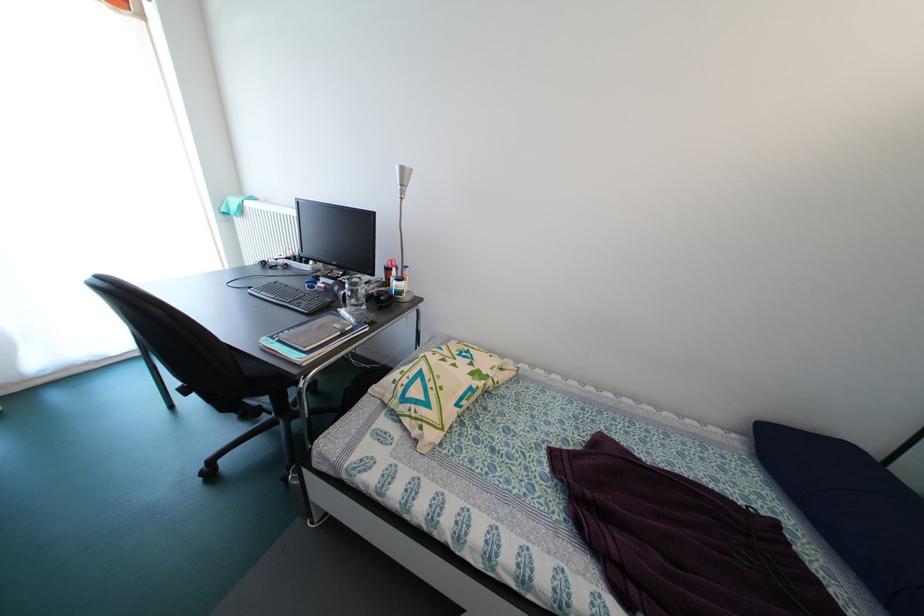
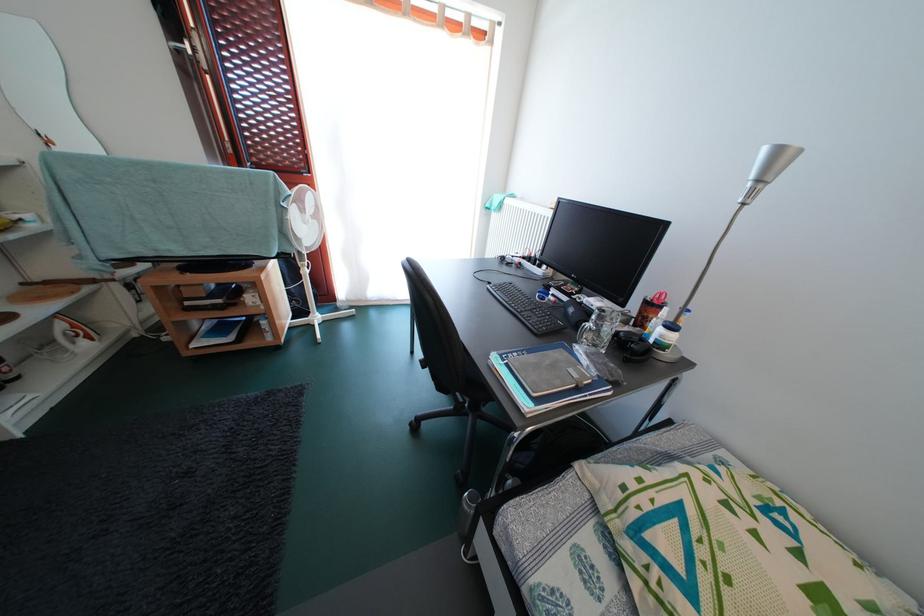
Where in the second image is the point corresponding to the point at 393,310 from the first image?

(640, 360)